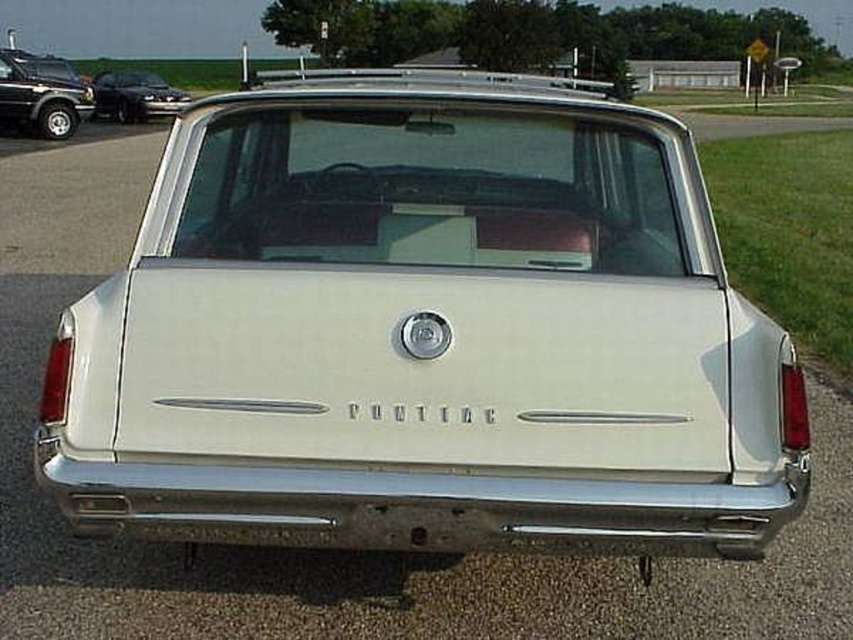
Between white matte station wagon at center and shiny black sedan at left, which one appears on the left side from the viewer's perspective?

Positioned to the left is shiny black sedan at left.

Can you confirm if white matte station wagon at center is positioned above shiny black sedan at left?

Incorrect, white matte station wagon at center is not positioned above shiny black sedan at left.

Is point (619, 484) less distant than point (155, 106)?

Yes.

Where is `white matte station wagon at center`? The height and width of the screenshot is (640, 853). white matte station wagon at center is located at coordinates (425, 332).

Describe the element at coordinates (425, 332) in the screenshot. I see `white matte station wagon at center` at that location.

This screenshot has width=853, height=640. Find the location of `white matte station wagon at center`. white matte station wagon at center is located at coordinates (425, 332).

Describe the element at coordinates (425, 332) in the screenshot. The height and width of the screenshot is (640, 853). I see `white matte station wagon at center` at that location.

At what (x,y) coordinates should I click in order to perform the action: click on white matte station wagon at center. Please return your answer as a coordinate pair (x, y). The image size is (853, 640). Looking at the image, I should click on (425, 332).

Who is lower down, matte black suv at upper left or shiny black sedan at left?

Positioned lower is matte black suv at upper left.

Is point (6, 88) in front of point (105, 104)?

Yes, point (6, 88) is in front of point (105, 104).

Identify the location of matte black suv at upper left. The height and width of the screenshot is (640, 853). (39, 97).